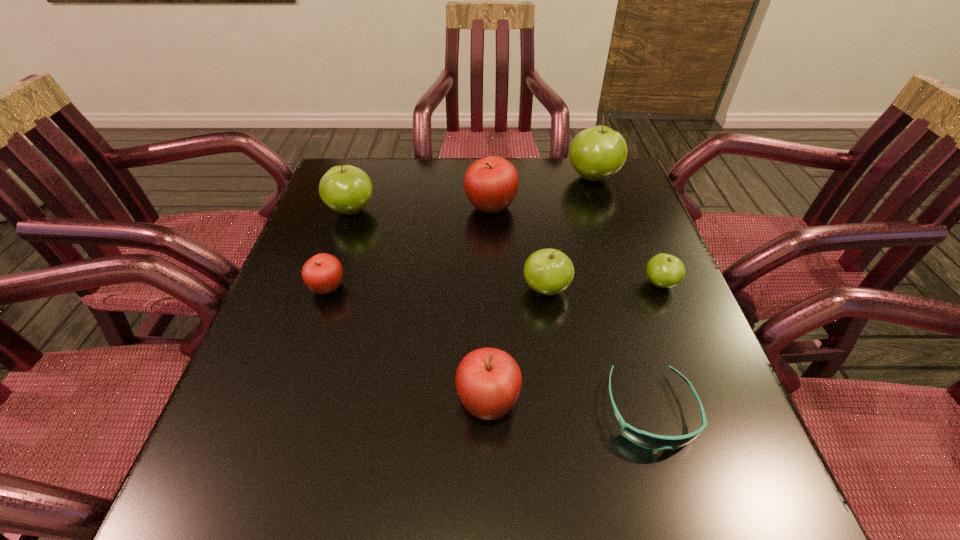
The image size is (960, 540). I want to click on sunglasses that is at the right edge, so click(647, 440).

This screenshot has width=960, height=540. Find the location of `object present at the far left corner`. object present at the far left corner is located at coordinates (346, 189).

Locate an element on the screen. The width and height of the screenshot is (960, 540). object that is at the far right corner is located at coordinates click(596, 153).

In the image, there is a desktop. Where is `vacant space at the far edge`? The width and height of the screenshot is (960, 540). vacant space at the far edge is located at coordinates (379, 204).

This screenshot has width=960, height=540. Find the location of `vacant area at the near edge`. vacant area at the near edge is located at coordinates (550, 472).

Where is `vacant space at the left edge`? vacant space at the left edge is located at coordinates (276, 392).

In order to click on free region at the right edge of the desktop in this screenshot , I will do point(624,340).

Locate an element on the screen. free space at the near left corner of the desktop is located at coordinates (239, 508).

Where is `free space between the second nearest red apple and the leftmost green apple`? The image size is (960, 540). free space between the second nearest red apple and the leftmost green apple is located at coordinates (340, 249).

Identify the location of vacant area that lies between the third nearest green apple and the farthest red apple. The height and width of the screenshot is (540, 960). (421, 209).